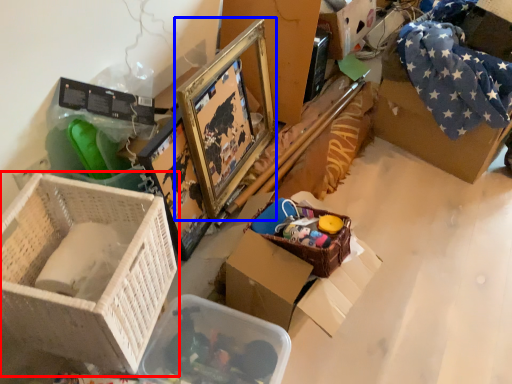
Question: Which of the following is the farthest to the observer, box (highlighted by a red box) or picture frame (highlighted by a blue box)?

Choices:
 (A) box
 (B) picture frame

Answer: (B)